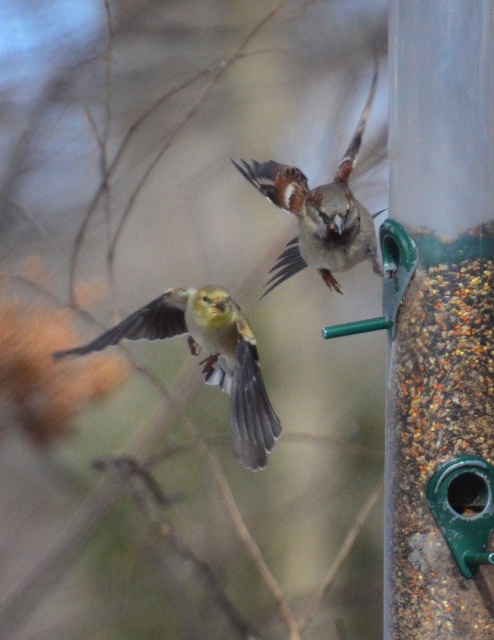
Can you confirm if golden yellow sparrow at left is taller than brown speckled feathers at center?

No, golden yellow sparrow at left is not taller than brown speckled feathers at center.

Between golden yellow sparrow at left and brown speckled feathers at center, which one has more height?

With more height is brown speckled feathers at center.

You are a GUI agent. You are given a task and a screenshot of the screen. Output one action in this format:
    pyautogui.click(x=<x>, y=<y>)
    Task: Click on the golden yellow sparrow at left
    
    Given the screenshot: What is the action you would take?
    pyautogui.click(x=208, y=358)

Locate an element on the screen. Image resolution: width=494 pixels, height=640 pixels. golden yellow sparrow at left is located at coordinates (208, 358).